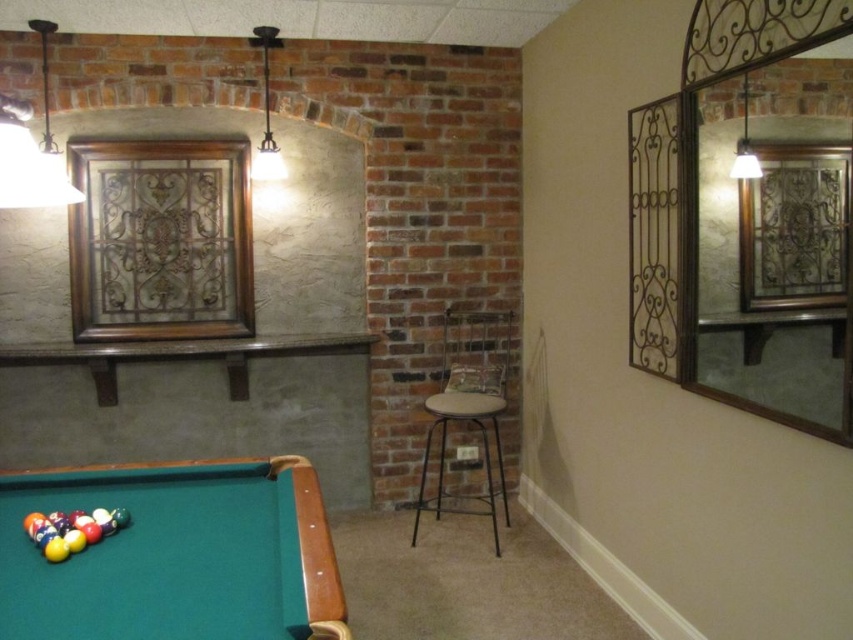
Between green felt pool table at lower left and metallic black bar stool at center, which one appears on the left side from the viewer's perspective?

Positioned to the left is green felt pool table at lower left.

Is point (26, 561) closer to viewer compared to point (444, 472)?

Yes, it is.

The height and width of the screenshot is (640, 853). In order to click on green felt pool table at lower left in this screenshot , I will do `click(169, 554)`.